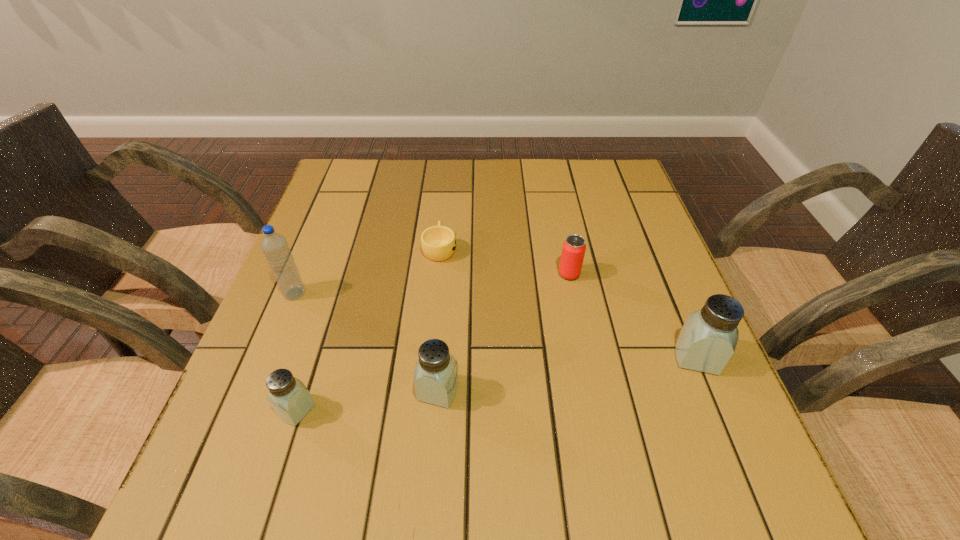
You are a GUI agent. You are given a task and a screenshot of the screen. Output one action in this format:
    pyautogui.click(x=<x>, y=<y>)
    Task: Click on the free point between the second farthest object and the rightmost saltshaker
    
    Given the screenshot: What is the action you would take?
    pyautogui.click(x=633, y=316)

Where is `vacant area that lies between the second saltshaker from right to left and the fifth object from left to right`? vacant area that lies between the second saltshaker from right to left and the fifth object from left to right is located at coordinates (504, 333).

In order to click on free space between the cup and the third tallest object in this screenshot , I will do `click(439, 320)`.

At what (x,y) coordinates should I click in order to perform the action: click on free spot between the leftmost saltshaker and the third tallest object. Please return your answer as a coordinate pair (x, y). Image resolution: width=960 pixels, height=540 pixels. Looking at the image, I should click on (368, 400).

Locate an element on the screen. blank region between the shortest object and the fifth object from right to left is located at coordinates (368, 329).

Where is `free spot between the third tallest object and the tallest object`? This screenshot has width=960, height=540. free spot between the third tallest object and the tallest object is located at coordinates (367, 342).

The height and width of the screenshot is (540, 960). In order to click on vacant space in between the shortest object and the third farthest object in this screenshot , I will do `click(367, 271)`.

Select which object is the second closest to the water bottle. Please provide its 2D coordinates. Your answer should be formatted as a tuple, i.e. [(x, y)], where the tuple contains the x and y coordinates of a point satisfying the conditions above.

[(438, 243)]

Find the location of a particular element. the closest object to the second object from left to right is located at coordinates (436, 379).

Locate an element on the screen. saltshaker that stands as the third closest to the fifth nearest object is located at coordinates (290, 399).